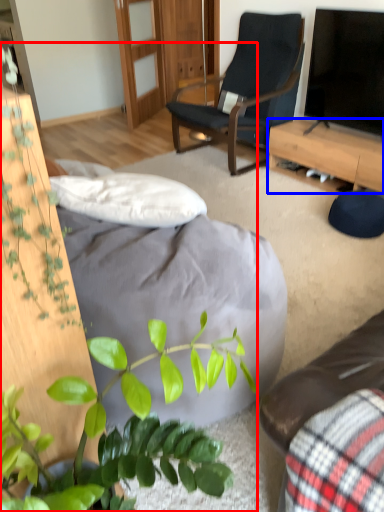
Question: Which object appears closest to the camera in this image, houseplant (highlighted by a red box) or desk (highlighted by a blue box)?

Choices:
 (A) houseplant
 (B) desk

Answer: (A)